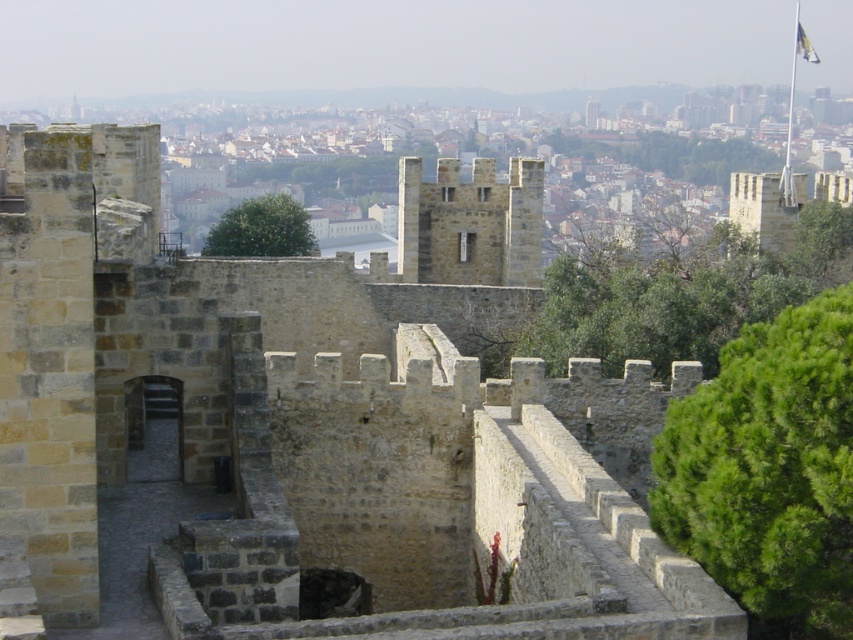
You are a knight standing at the entrance of the fortress. You notice the stone wall at center and the white fabric flag at upper right. Which object is wider?

The white fabric flag at upper right is wider than the stone wall at center.

You are standing at the entrance of the fortress and notice two points marked on the wall. The first point is at coordinate point (x=647, y=609) and the second is at point (x=804, y=42). Which point is closer to you as you face the fortress wall?

Point (x=647, y=609) is closer to the camera than point (x=804, y=42), so the first point is closer to you as you face the fortress wall.